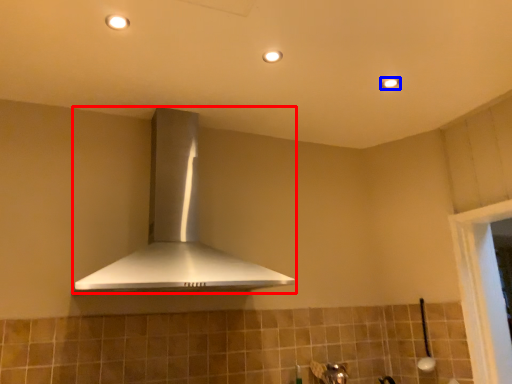
Question: Which object is further to the camera taking this photo, home appliance (highlighted by a red box) or light fixture (highlighted by a blue box)?

Choices:
 (A) home appliance
 (B) light fixture

Answer: (B)